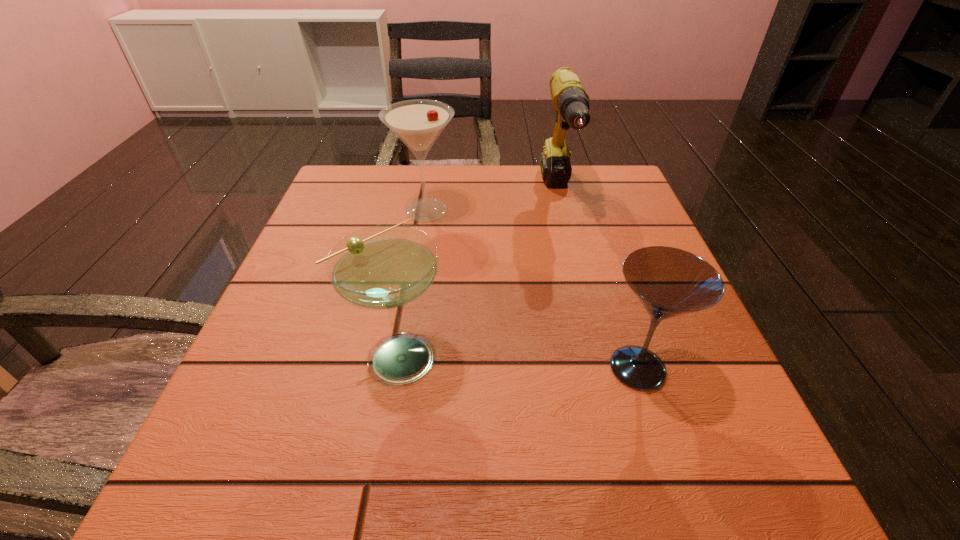
Where is `free spot between the drill and the farthest martini`? The width and height of the screenshot is (960, 540). free spot between the drill and the farthest martini is located at coordinates (492, 202).

Where is `vacant space that's between the drill and the farthest martini`? The height and width of the screenshot is (540, 960). vacant space that's between the drill and the farthest martini is located at coordinates (492, 202).

Where is `vacant space that's between the drill and the shortest object`? This screenshot has width=960, height=540. vacant space that's between the drill and the shortest object is located at coordinates (598, 281).

The height and width of the screenshot is (540, 960). Find the location of `vacant space that is in between the shortest martini and the drill`. vacant space that is in between the shortest martini and the drill is located at coordinates (598, 281).

The image size is (960, 540). What are the coordinates of `the closest object relative to the farthest martini` in the screenshot? It's located at (571, 101).

I want to click on the closest object to the drill, so click(x=418, y=123).

Identify which martini is located as the nearest to the drill. Please provide its 2D coordinates. Your answer should be formatted as a tuple, i.e. [(x, y)], where the tuple contains the x and y coordinates of a point satisfying the conditions above.

[(418, 123)]

Select which martini appears as the third closest to the drill. Please provide its 2D coordinates. Your answer should be formatted as a tuple, i.e. [(x, y)], where the tuple contains the x and y coordinates of a point satisfying the conditions above.

[(382, 267)]

Identify the location of blank area in the image that satisfies the following two spatial constraints: 1. on the handle side of the rightmost martini; 2. on the right side of the drill. (601, 368).

I want to click on blank area in the image that satisfies the following two spatial constraints: 1. on the handle side of the drill; 2. on the left side of the shortest martini, so click(x=601, y=368).